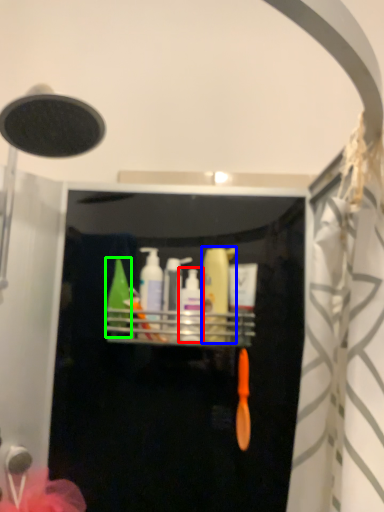
Question: Which is nearer to the toiletry (highlighted by a red box)? toiletry (highlighted by a blue box) or toiletry (highlighted by a green box).

Choices:
 (A) toiletry
 (B) toiletry

Answer: (A)